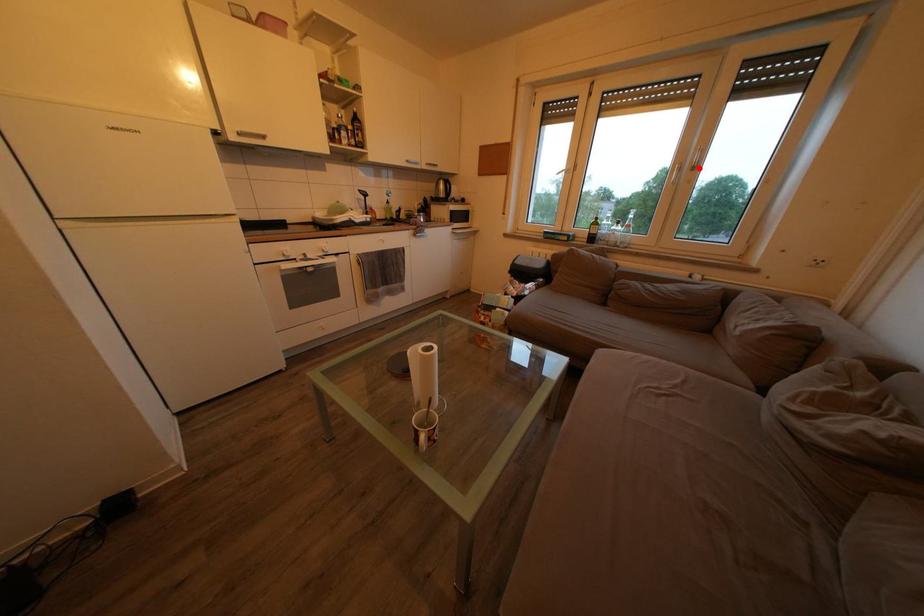
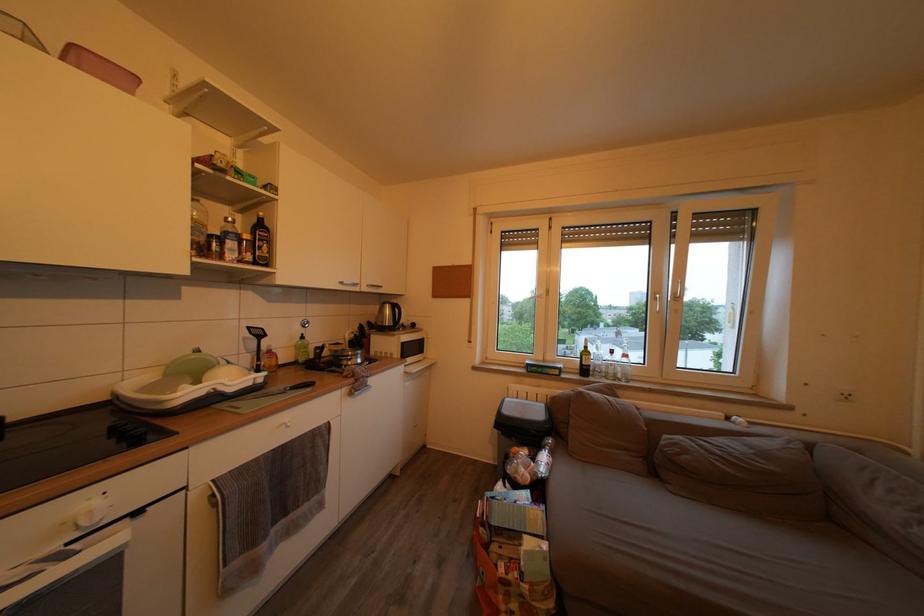
In the second image, find the point that corresponds to the highlighted location in the first image.

(682, 300)